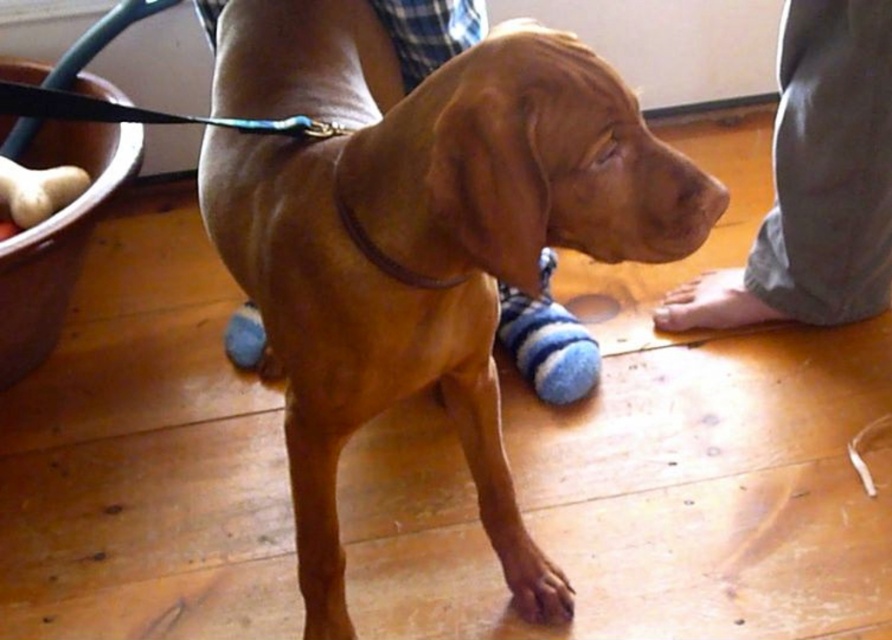
You are a dog trainer observing the brown fur paw at lower center and the brown smooth nose at center. Which part of the dog is closer to you?

The brown fur paw at lower center is closer to you than the brown smooth nose at center because it is positioned further to the viewer.

You are a dog trainer observing the brown fur paw at lower center and the brown smooth nose at center. Which of these two features is bigger in size?

The brown fur paw at lower center is larger in size compared to the brown smooth nose at center.